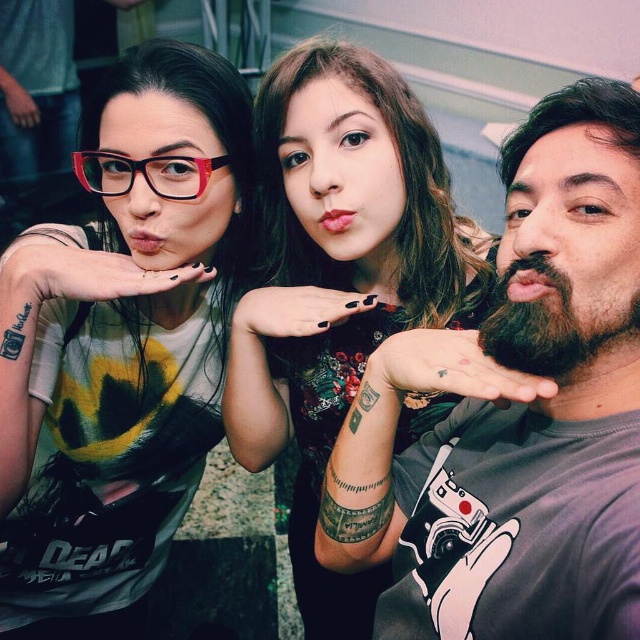
Question: Is matte black glasses at upper left to the left of translucent plastic glasses at upper left from the viewer's perspective?

Choices:
 (A) no
 (B) yes

Answer: (B)

Question: Does matte black shirt at center have a smaller size compared to dark brown thick beard at right?

Choices:
 (A) yes
 (B) no

Answer: (B)

Question: Among these objects, which one is farthest from the camera?

Choices:
 (A) dark brown thick beard at right
 (B) matte black shirt at center
 (C) bearded man at center

Answer: (B)

Question: Which is nearer to the translucent plastic glasses at upper left?

Choices:
 (A) matte black shirt at center
 (B) matte black glasses at upper left
 (C) bearded man at center
 (D) dark brown thick beard at right

Answer: (B)

Question: Is matte black glasses at upper left thinner than translucent plastic glasses at upper left?

Choices:
 (A) no
 (B) yes

Answer: (A)

Question: Which point is farther to the camera?

Choices:
 (A) [285, 384]
 (B) [602, 349]

Answer: (A)